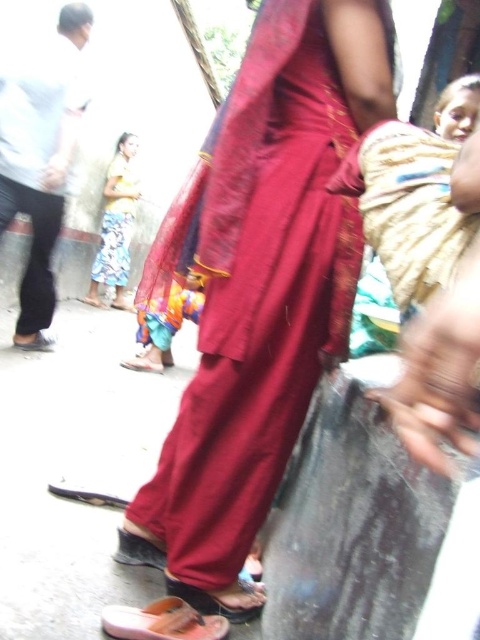
Question: Does yellow fabric dress at lower left have a larger size compared to brown leather sandal at lower center?

Choices:
 (A) yes
 (B) no

Answer: (A)

Question: Considering the real-world distances, which object is closest to the yellow fabric dress at lower left?

Choices:
 (A) matte red fabric at center
 (B) brown leather sandal at lower center

Answer: (A)

Question: Is yellow fabric dress at lower left below brown leather sandal at lower center?

Choices:
 (A) yes
 (B) no

Answer: (B)

Question: Considering the real-world distances, which object is farthest from the brown leather sandal at lower center?

Choices:
 (A) yellow fabric dress at lower left
 (B) matte red fabric at center
 (C) orange rubber sandal at lower center

Answer: (A)

Question: Which point is closer to the camera?

Choices:
 (A) brown leather sandal at lower center
 (B) matte red fabric at center
 (C) orange rubber sandal at lower center
 (D) yellow fabric dress at lower left

Answer: (C)

Question: Does matte red fabric at center appear on the right side of orange rubber sandal at lower center?

Choices:
 (A) no
 (B) yes

Answer: (B)